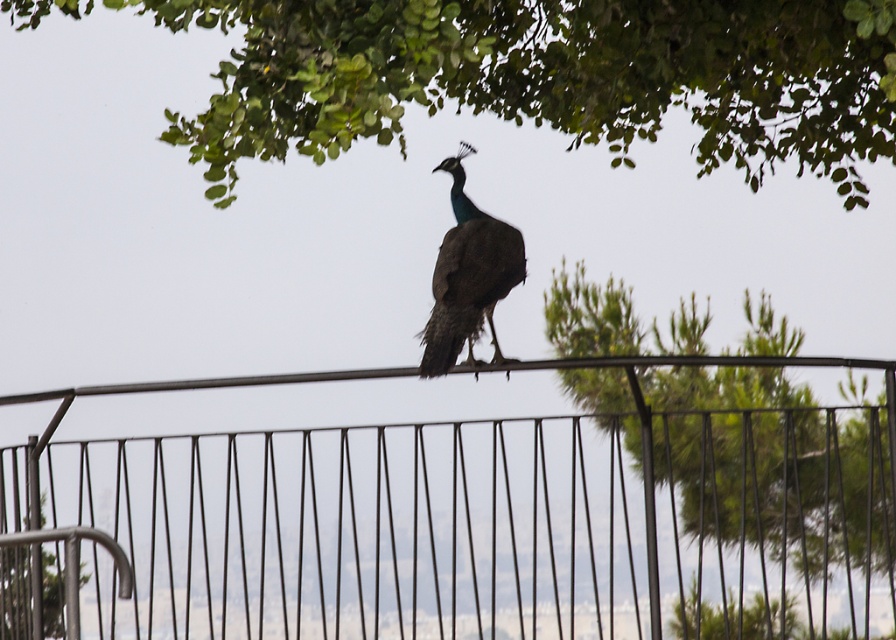
You are a birdwatcher observing the scene. You notice the green leafy tree at upper center and the shiny blue peacock at center. Which object takes up more space in the image?

The green leafy tree at upper center is bigger than the shiny blue peacock at center, so it takes up more space in the image.

From the picture: You are standing in a garden and see a peacock on the black metal fence at center. If you want to approach the peacock without getting too close to the fence, which direction should you move relative to the fence?

The black metal fence at center is located at point (461, 522). To approach the peacock without getting too close to the fence, you should move towards the direction opposite to the fence, which would be away from the coordinates mentioned.